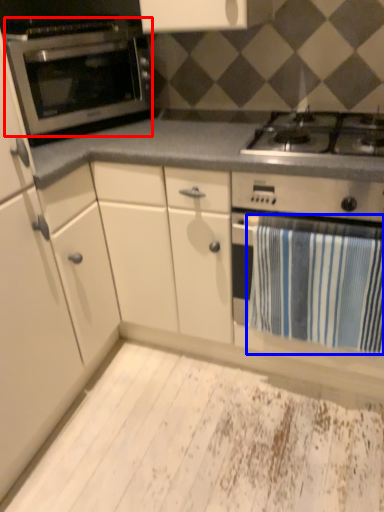
Question: Which of the following is the farthest to the observer, oven (highlighted by a red box) or bath towel (highlighted by a blue box)?

Choices:
 (A) oven
 (B) bath towel

Answer: (A)